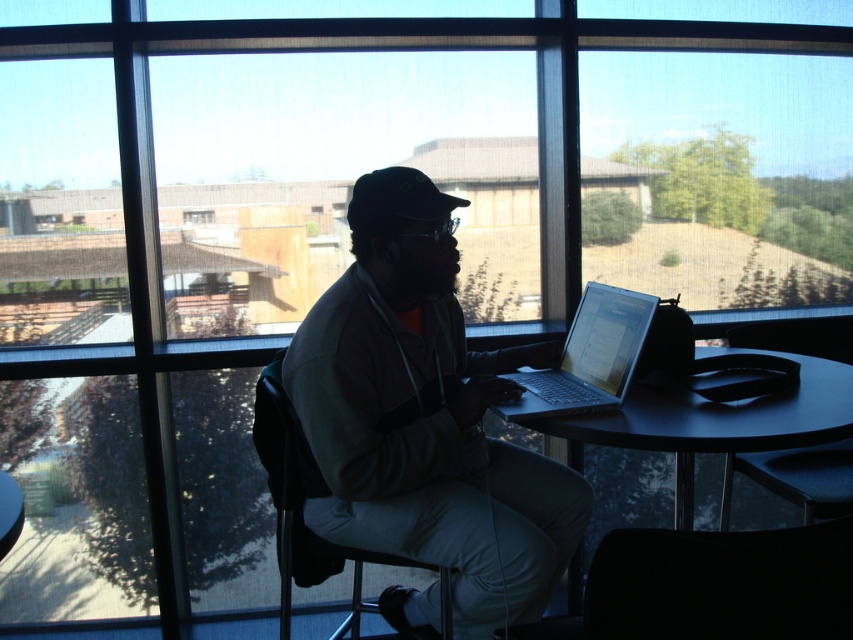
Question: Where is dark gray hoodie at center located in relation to silver metallic laptop at center in the image?

Choices:
 (A) above
 (B) below

Answer: (B)

Question: Which of the following is the closest to the observer?

Choices:
 (A) (569, 417)
 (B) (587, 352)

Answer: (A)

Question: Is black plastic table at center positioned in front of dark gray plastic chair at center?

Choices:
 (A) no
 (B) yes

Answer: (B)

Question: Is black plastic table at center in front of silver metallic laptop at center?

Choices:
 (A) no
 (B) yes

Answer: (B)

Question: Which object is farther from the camera taking this photo?

Choices:
 (A) silver metallic laptop at center
 (B) black plastic table at center

Answer: (A)

Question: Estimate the real-world distances between objects in this image. Which object is farther from the dark gray plastic chair at center?

Choices:
 (A) black plastic table at center
 (B) silver metallic laptop at center
 (C) clear glass window at center

Answer: (C)